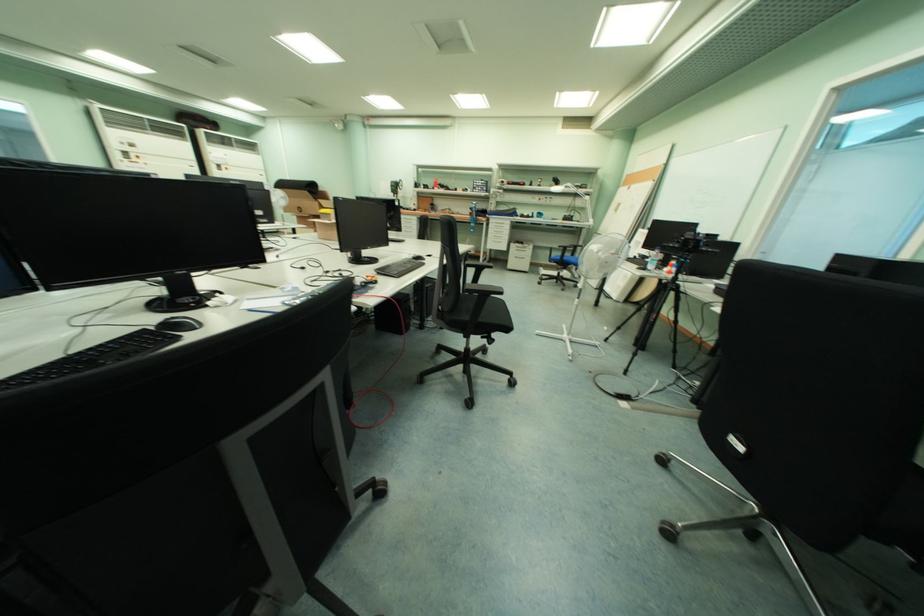
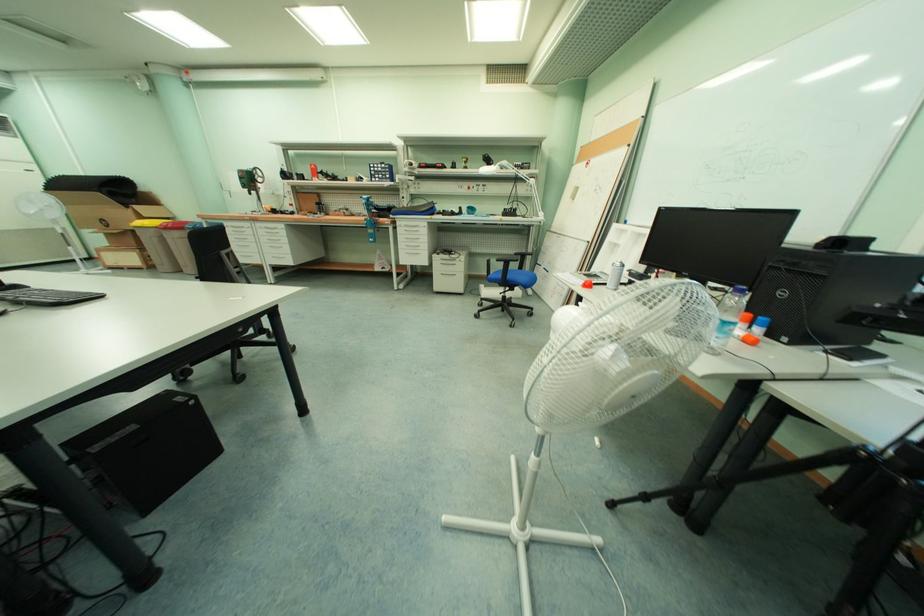
The images are taken continuously from a first-person perspective. In which direction are you moving?

The movement direction of the cameraman is right, forward.